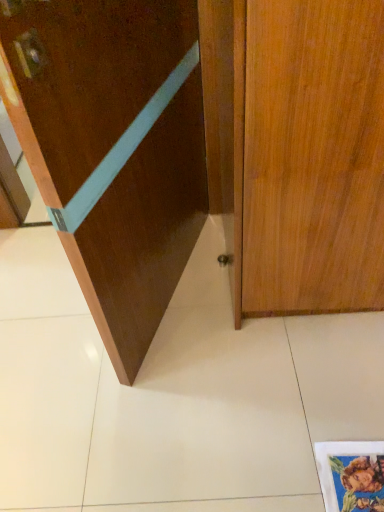
Locate an element on the screen. This screenshot has height=512, width=384. matte paper at lower right is located at coordinates (351, 475).

What do you see at coordinates (351, 475) in the screenshot? I see `matte paper at lower right` at bounding box center [351, 475].

Measure the distance between matte paper at lower right and camera.

The distance of matte paper at lower right from camera is 3.39 feet.

At what (x,y) coordinates should I click in order to perform the action: click on matte paper at lower right. Please return your answer as a coordinate pair (x, y). This screenshot has height=512, width=384. Looking at the image, I should click on (351, 475).